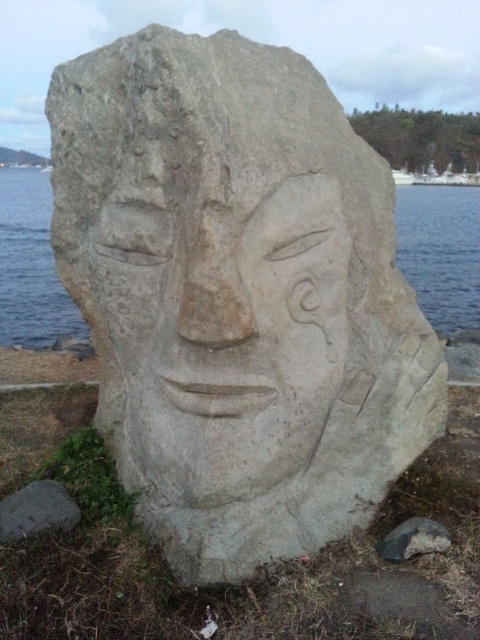
Question: Estimate the real-world distances between objects in this image. Which object is closer to the gray stone carving at lower right?

Choices:
 (A) clear water at lower left
 (B) gray rough rock at lower left
 (C) white stone face at center

Answer: (C)

Question: Among these points, which one is farthest from the camera?

Choices:
 (A) (6, 529)
 (B) (432, 548)
 (C) (343, 241)

Answer: (A)

Question: In this image, where is white stone face at center located relative to gray stone carving at lower right?

Choices:
 (A) above
 (B) below

Answer: (A)

Question: Considering the real-world distances, which object is farthest from the gray stone carving at lower right?

Choices:
 (A) clear water at lower left
 (B) white stone face at center

Answer: (A)

Question: From the image, what is the correct spatial relationship of white stone face at center in relation to clear water at lower left?

Choices:
 (A) below
 (B) above

Answer: (A)

Question: Is clear water at lower left further to the viewer compared to gray stone carving at lower right?

Choices:
 (A) no
 (B) yes

Answer: (B)